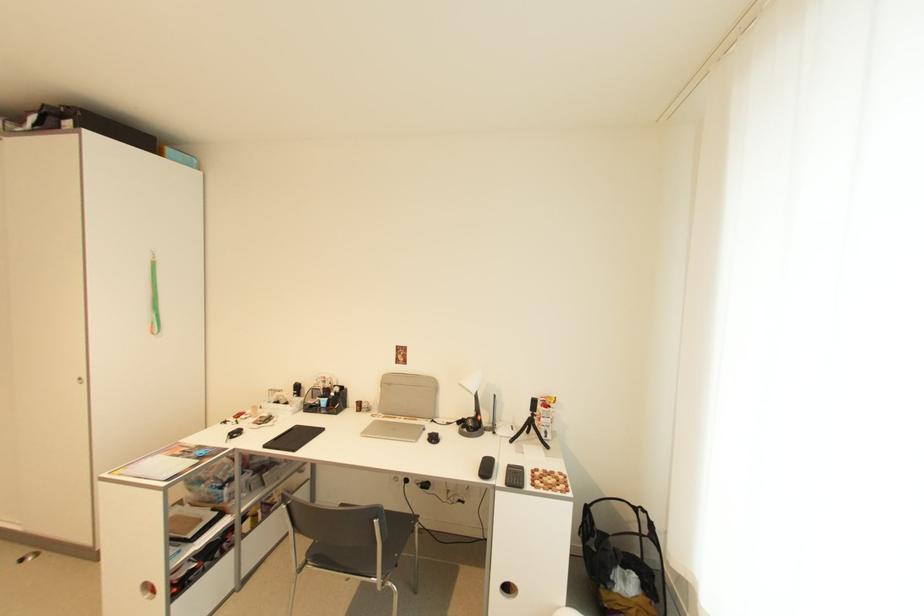
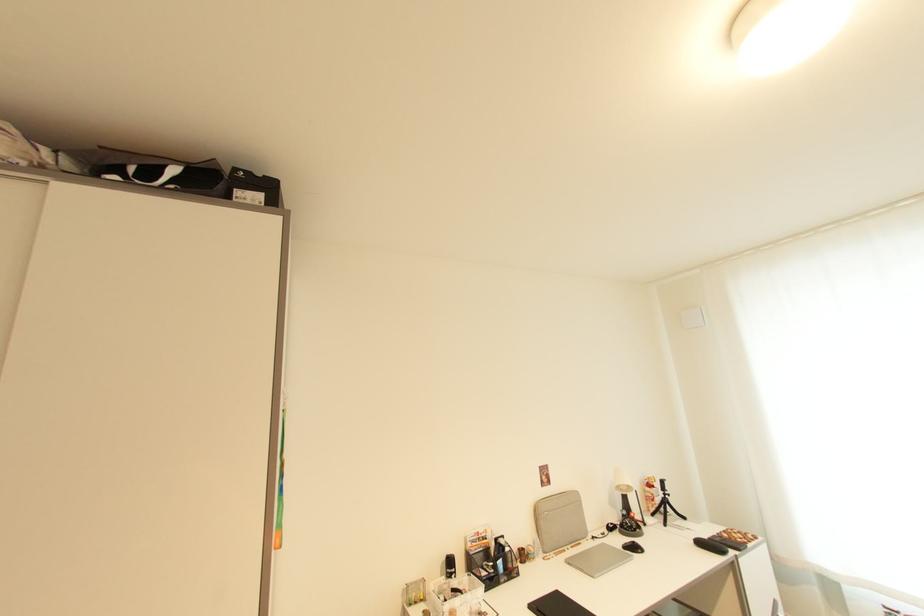
In the second image, find the point that corresponds to the point at 535,418 in the first image.

(669, 498)